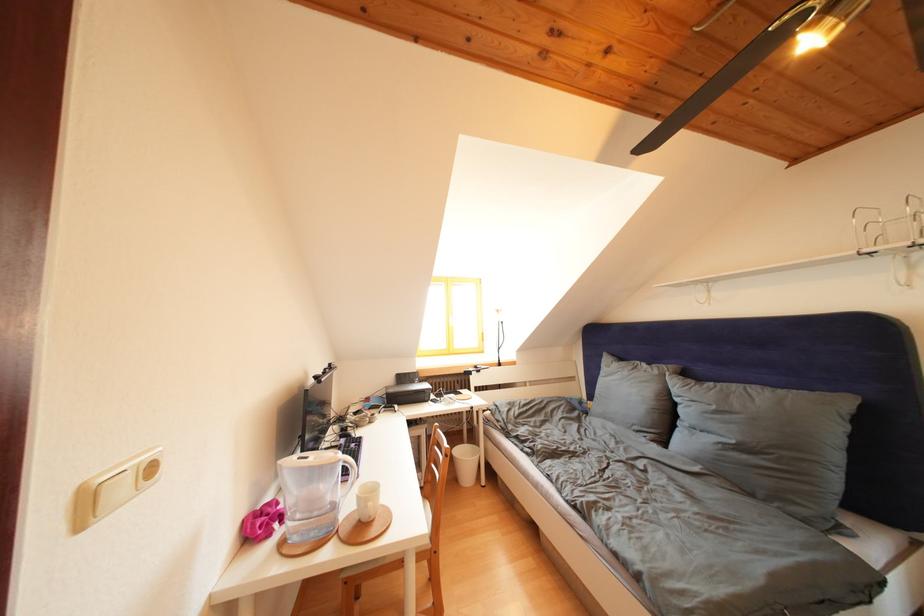
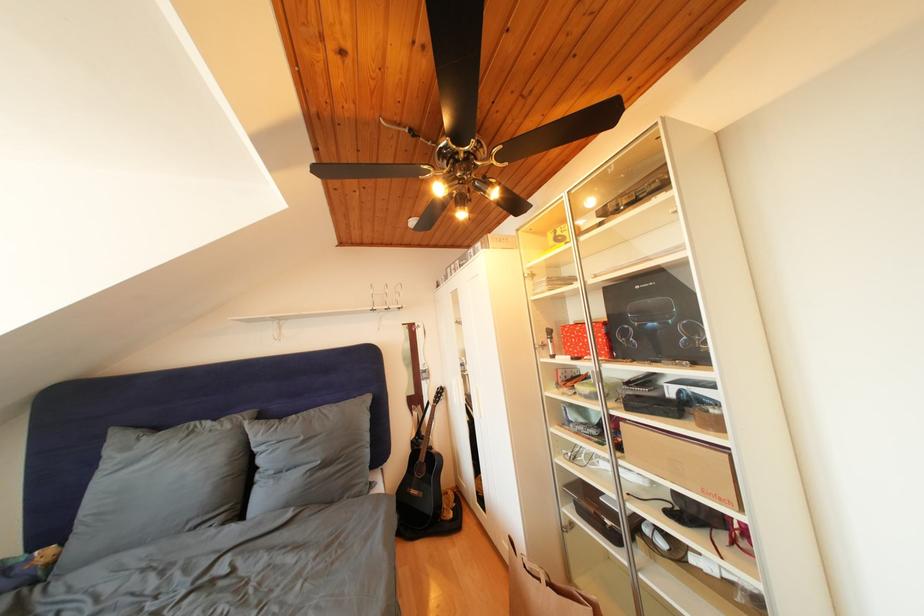
Question: The camera is either moving clockwise (left) or counter-clockwise (right) around the object. The first image is from the beginning of the video and the second image is from the end. Is the camera moving left or right when shooting the video?

Choices:
 (A) Left
 (B) Right

Answer: (A)